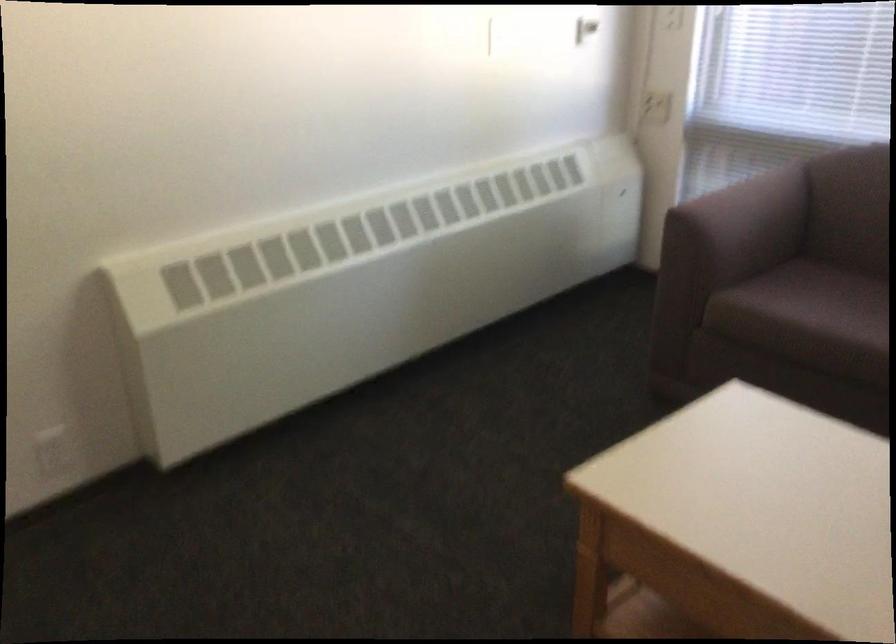
This screenshot has height=644, width=896. Find the location of `brown chair armrest`. brown chair armrest is located at coordinates (752, 207).